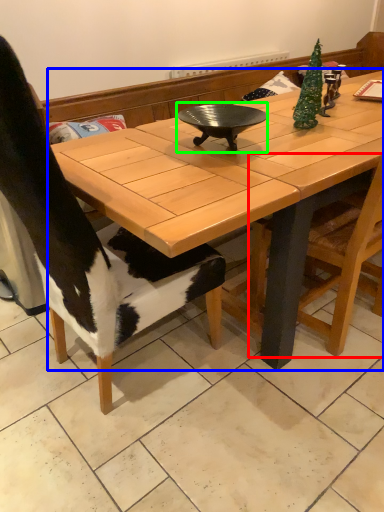
Question: Which object is positioned closest to chair (highlighted by a red box)? Select from coffee table (highlighted by a blue box) and wok (highlighted by a green box).

Choices:
 (A) coffee table
 (B) wok

Answer: (A)